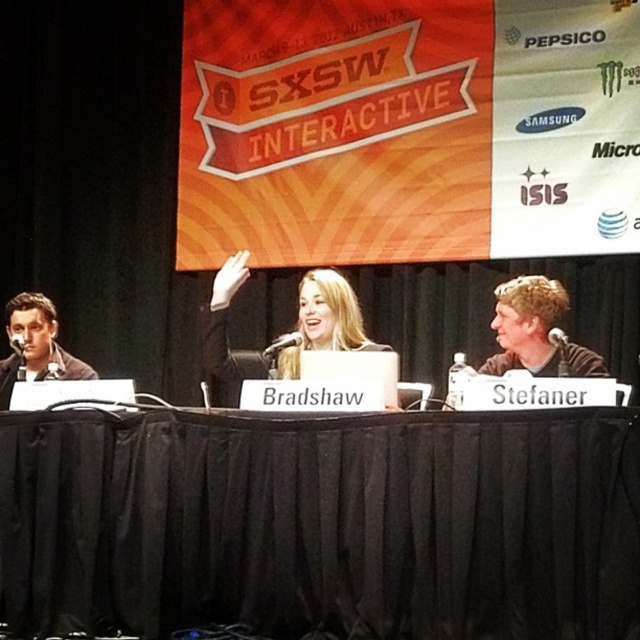
Is blonde hair at center bigger than matte black jacket at left?

Yes.

Describe the element at coordinates (324, 321) in the screenshot. I see `blonde hair at center` at that location.

Locate an element on the screen. The width and height of the screenshot is (640, 640). blonde hair at center is located at coordinates (324, 321).

Can you confirm if black fabric table at center is wider than light brown hair at right?

Correct, the width of black fabric table at center exceeds that of light brown hair at right.

Is point (371, 445) behind point (518, 349)?

No, (371, 445) is in front of (518, 349).

Who is more distant from viewer, (572, 538) or (518, 280)?

Point (518, 280)

I want to click on black fabric table at center, so click(323, 522).

Does light brown hair at right have a larger size compared to matte black jacket at left?

Incorrect, light brown hair at right is not larger than matte black jacket at left.

Is light brown hair at right wider than matte black jacket at left?

Correct, the width of light brown hair at right exceeds that of matte black jacket at left.

Find the location of a particular element. The width and height of the screenshot is (640, 640). light brown hair at right is located at coordinates (525, 324).

You are a GUI agent. You are given a task and a screenshot of the screen. Output one action in this format:
    pyautogui.click(x=<x>, y=<y>)
    Task: Click on the light brown hair at right
    The height and width of the screenshot is (640, 640).
    Given the screenshot: What is the action you would take?
    pyautogui.click(x=525, y=324)